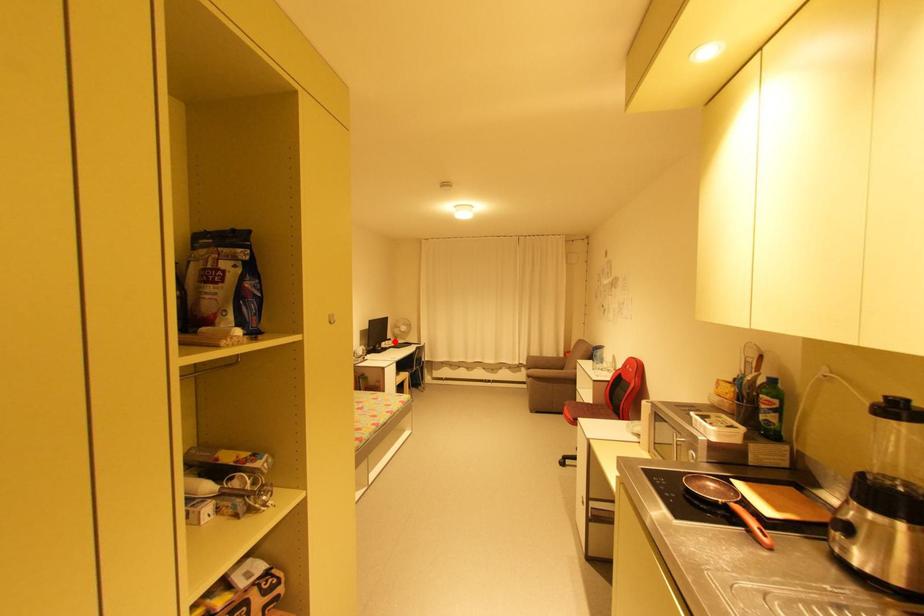
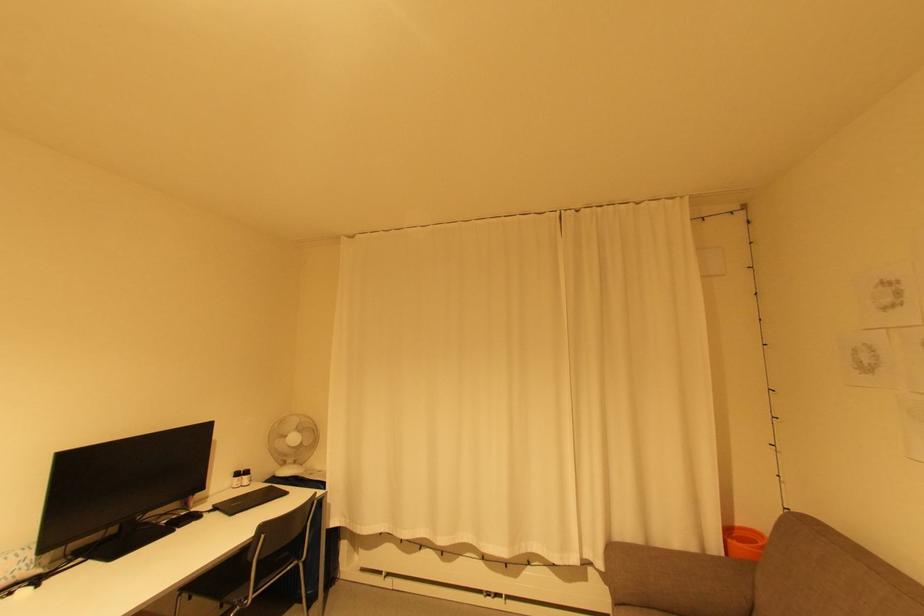
Locate, in the second image, the point that corresponds to the highlighted location in the first image.

(250, 477)